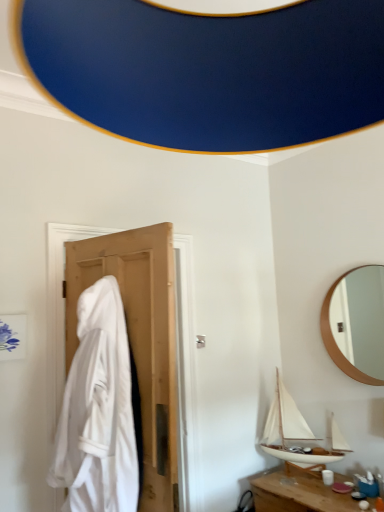
Question: Is white wood boat at lower right facing away from wooden round mirror at upper right?

Choices:
 (A) no
 (B) yes

Answer: (A)

Question: From a real-world perspective, is white wood boat at lower right positioned under wooden round mirror at upper right based on gravity?

Choices:
 (A) no
 (B) yes

Answer: (B)

Question: Considering the relative sizes of white wood boat at lower right and wooden round mirror at upper right in the image provided, is white wood boat at lower right bigger than wooden round mirror at upper right?

Choices:
 (A) yes
 (B) no

Answer: (A)

Question: Is white wood boat at lower right far from wooden round mirror at upper right?

Choices:
 (A) yes
 (B) no

Answer: (A)

Question: From a real-world perspective, is white wood boat at lower right positioned over wooden round mirror at upper right based on gravity?

Choices:
 (A) yes
 (B) no

Answer: (B)

Question: Does white wood boat at lower right lie in front of wooden round mirror at upper right?

Choices:
 (A) yes
 (B) no

Answer: (B)

Question: Is white fabric at left a part of wooden table at lower right?

Choices:
 (A) yes
 (B) no

Answer: (B)

Question: Is wooden table at lower right completely or partially outside of white fabric at left?

Choices:
 (A) no
 (B) yes

Answer: (B)

Question: Is the depth of wooden table at lower right greater than that of white fabric at left?

Choices:
 (A) no
 (B) yes

Answer: (B)

Question: Is wooden table at lower right with white fabric at left?

Choices:
 (A) yes
 (B) no

Answer: (B)

Question: Considering the relative positions of wooden table at lower right and white fabric at left in the image provided, is wooden table at lower right to the right of white fabric at left from the viewer's perspective?

Choices:
 (A) yes
 (B) no

Answer: (A)

Question: From the image's perspective, is wooden table at lower right below white fabric at left?

Choices:
 (A) yes
 (B) no

Answer: (A)

Question: Considering the relative sizes of wooden table at lower right and wooden round mirror at upper right in the image provided, is wooden table at lower right taller than wooden round mirror at upper right?

Choices:
 (A) no
 (B) yes

Answer: (A)